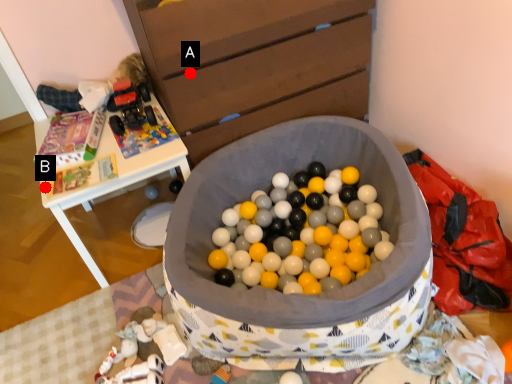
Question: Two points are circled on the image, labeled by A and B beside each circle. Which point is closer to the camera?

Choices:
 (A) A is closer
 (B) B is closer

Answer: (A)